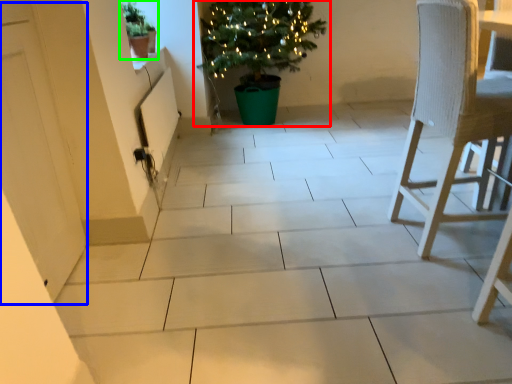
Question: Which object is positioned closest to houseplant (highlighted by a red box)? Select from screen door (highlighted by a blue box) and houseplant (highlighted by a green box).

Choices:
 (A) screen door
 (B) houseplant

Answer: (B)